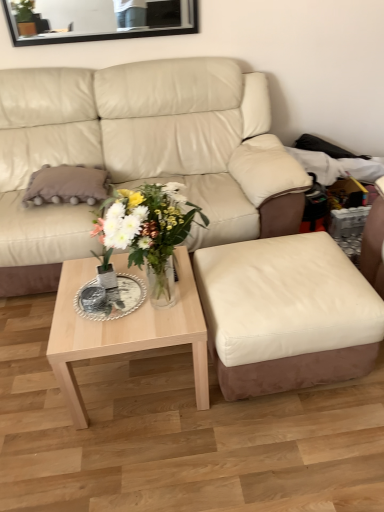
Image resolution: width=384 pixels, height=512 pixels. I want to click on blank space situated above leather ottoman at center (from a real-world perspective), so click(288, 270).